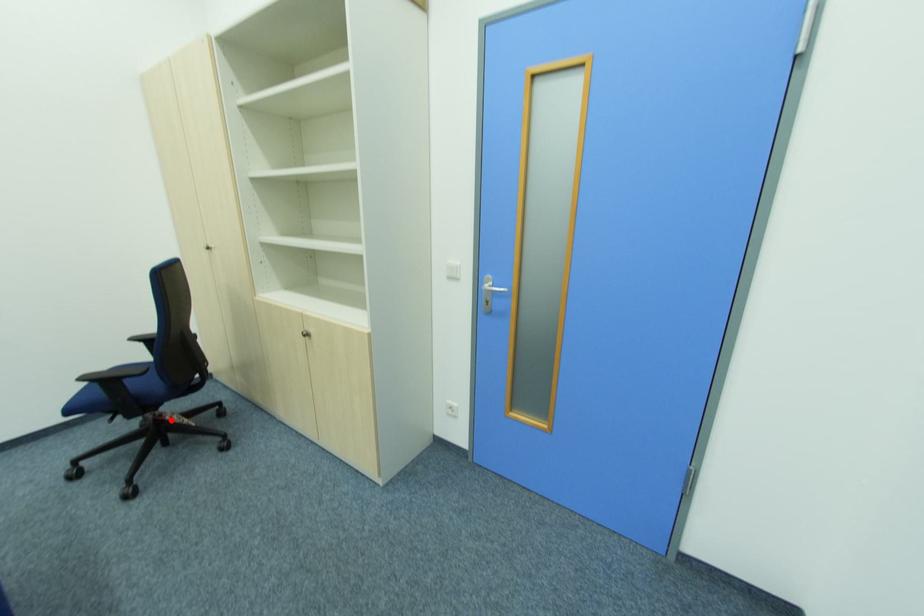
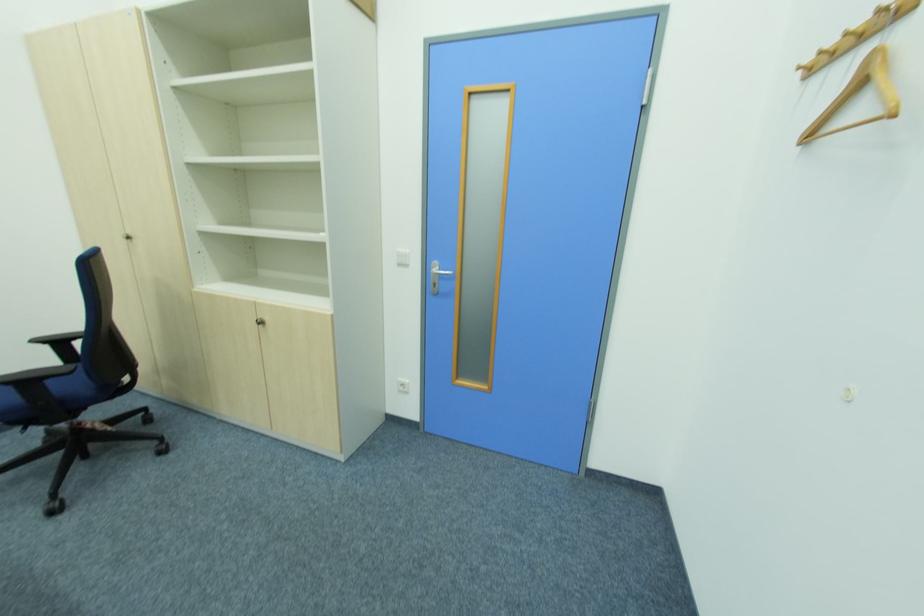
The point at the highlighted location is marked in the first image. Where is the corresponding point in the second image?

(91, 429)